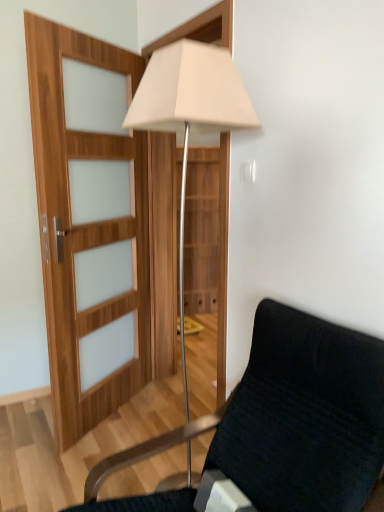
Measure the distance between white fabric lamp at center and camera.

white fabric lamp at center is 4.13 feet from camera.

At what (x,y) coordinates should I click in order to perform the action: click on white fabric lamp at center. Please return your answer as a coordinate pair (x, y). The image size is (384, 512). Looking at the image, I should click on (190, 113).

What do you see at coordinates (190, 113) in the screenshot?
I see `white fabric lamp at center` at bounding box center [190, 113].

The height and width of the screenshot is (512, 384). I want to click on velvet black chair at lower right, so click(x=283, y=423).

Describe the element at coordinates (283, 423) in the screenshot. I see `velvet black chair at lower right` at that location.

What are the coordinates of `white fabric lamp at center` in the screenshot? It's located at (190, 113).

Between white fabric lamp at center and velvet black chair at lower right, which one appears on the right side from the viewer's perspective?

From the viewer's perspective, velvet black chair at lower right appears more on the right side.

Is white fabric lamp at center further to the viewer compared to velvet black chair at lower right?

Yes, it is.

Does point (184, 89) appear closer or farther from the camera than point (164, 496)?

Clearly, point (184, 89) is closer to the camera than point (164, 496).

From the image's perspective, is white fabric lamp at center on velvet black chair at lower right?

Indeed, from the image's perspective, white fabric lamp at center is shown above velvet black chair at lower right.

From a real-world perspective, is white fabric lamp at center positioned under velvet black chair at lower right based on gravity?

Actually, white fabric lamp at center is physically above velvet black chair at lower right in the real world.

Considering the sizes of objects white fabric lamp at center and velvet black chair at lower right in the image provided, who is wider, white fabric lamp at center or velvet black chair at lower right?

velvet black chair at lower right.

Which of these two, white fabric lamp at center or velvet black chair at lower right, stands shorter?

velvet black chair at lower right.

Does white fabric lamp at center have a larger size compared to velvet black chair at lower right?

Actually, white fabric lamp at center might be smaller than velvet black chair at lower right.

Is velvet black chair at lower right completely or partially inside white fabric lamp at center?

No, velvet black chair at lower right is located outside of white fabric lamp at center.

Are white fabric lamp at center and velvet black chair at lower right located far from each other?

No.

Is white fabric lamp at center facing towards velvet black chair at lower right?

No.

From the picture: Measure the distance from white fabric lamp at center to velvet black chair at lower right.

38.72 inches.

At what (x,y) coordinates should I click in order to perform the action: click on lamp on the left of the velvet black chair at lower right. Please return your answer as a coordinate pair (x, y). This screenshot has height=512, width=384. Looking at the image, I should click on (190, 113).

Which object is positioned more to the right, velvet black chair at lower right or white fabric lamp at center?

velvet black chair at lower right is more to the right.

Considering the relative positions of velvet black chair at lower right and white fabric lamp at center in the image provided, is velvet black chair at lower right behind white fabric lamp at center?

No, it is not.

Is point (298, 490) positioned before point (213, 95)?

That is True.

From the image's perspective, is velvet black chair at lower right on white fabric lamp at center?

Actually, velvet black chair at lower right appears below white fabric lamp at center in the image.

From a real-world perspective, is velvet black chair at lower right above or below white fabric lamp at center?

velvet black chair at lower right is situated lower than white fabric lamp at center in the real world.

Considering the sizes of objects velvet black chair at lower right and white fabric lamp at center in the image provided, who is wider, velvet black chair at lower right or white fabric lamp at center?

velvet black chair at lower right is wider.

Who is shorter, velvet black chair at lower right or white fabric lamp at center?

velvet black chair at lower right is shorter.

Which of these two, velvet black chair at lower right or white fabric lamp at center, is bigger?

Bigger between the two is velvet black chair at lower right.

Is velvet black chair at lower right inside the boundaries of white fabric lamp at center, or outside?

velvet black chair at lower right is located beyond the bounds of white fabric lamp at center.

Is velvet black chair at lower right placed right next to white fabric lamp at center?

velvet black chair at lower right and white fabric lamp at center are not in contact.

Is velvet black chair at lower right facing away from white fabric lamp at center?

No, velvet black chair at lower right is not facing the opposite direction of white fabric lamp at center.

How different are the orientations of velvet black chair at lower right and white fabric lamp at center in degrees?

The angle between the facing direction of velvet black chair at lower right and the facing direction of white fabric lamp at center is 0.113 degrees.

Measure the distance between velvet black chair at lower right and white fabric lamp at center.

velvet black chair at lower right and white fabric lamp at center are 38.72 inches apart from each other.

Locate an element on the screen. The image size is (384, 512). chair in front of the white fabric lamp at center is located at coordinates (283, 423).

The width and height of the screenshot is (384, 512). I want to click on lamp located above the velvet black chair at lower right (from a real-world perspective), so click(x=190, y=113).

This screenshot has height=512, width=384. Find the location of `lamp on the left of velvet black chair at lower right`. lamp on the left of velvet black chair at lower right is located at coordinates (190, 113).